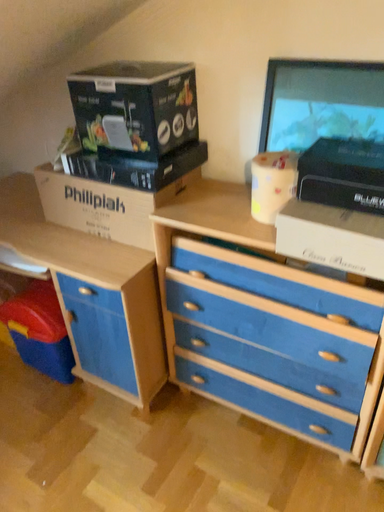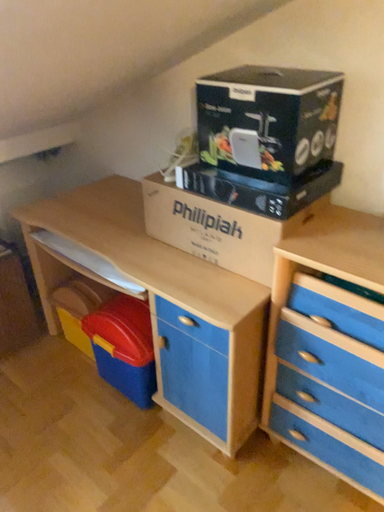
Question: How did the camera likely rotate when shooting the video?

Choices:
 (A) rotated left
 (B) rotated right

Answer: (A)